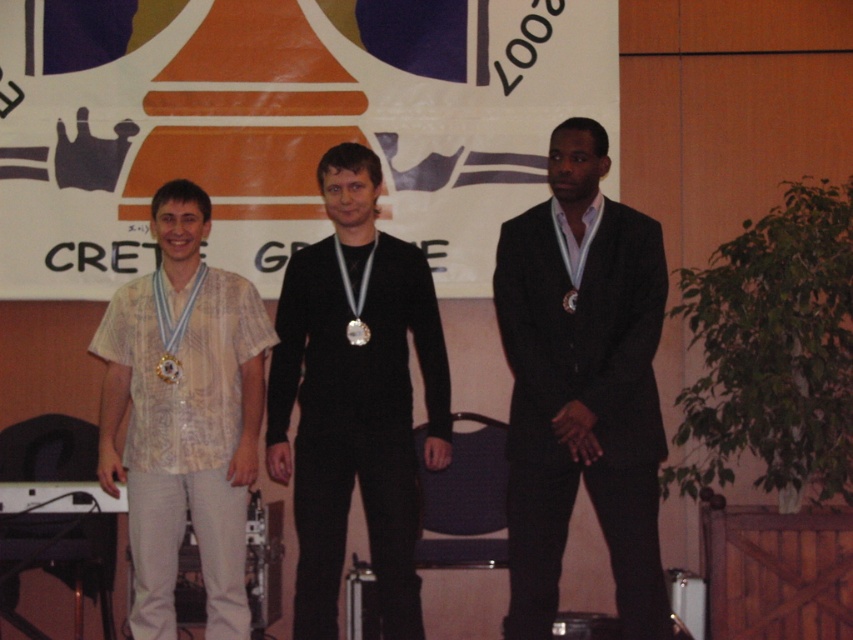
You are standing in front of the stage where the three medalists are standing. You notice a point at coordinates (183,416). Which object from the scene is located at that point?

The patterned fabric shirt at left is located at point (183,416).

You are a photographer taking a picture of the stage. You notice the dark suit at center and the patterned fabric shirt at left. Which one is covering part of the other?

The dark suit at center is positioned over patterned fabric shirt at left, so the dark suit at center is covering part of the patterned fabric shirt at left.